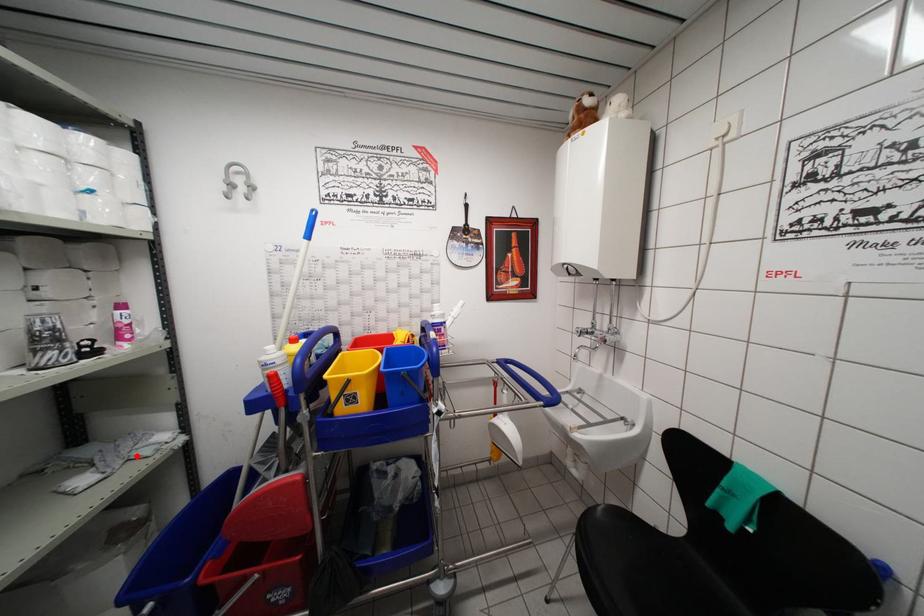
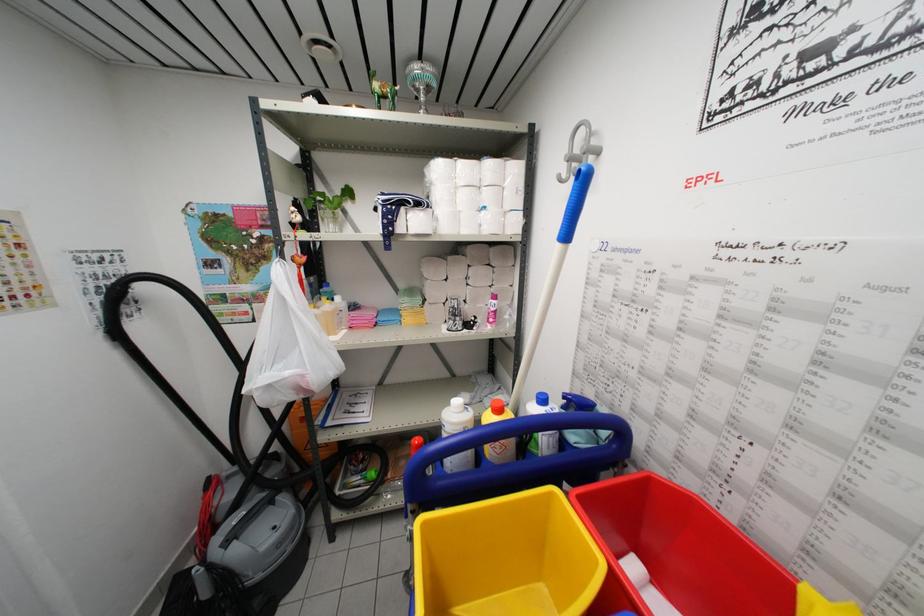
In the second image, find the point that corresponds to the highlighted location in the first image.

(490, 402)